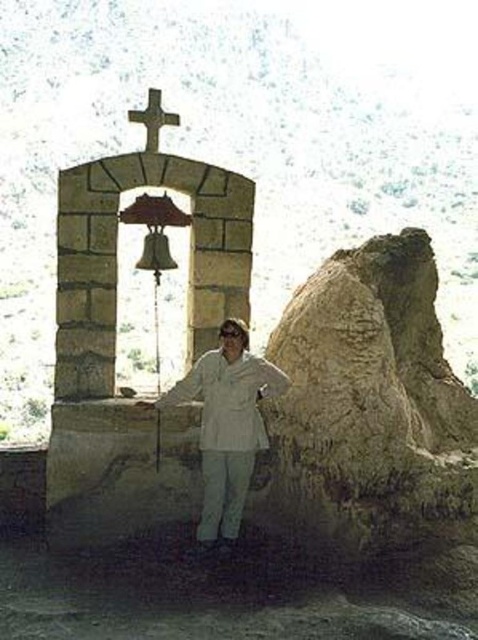
Between white matte jacket at center and metallic cross at upper center, which one is positioned lower?

Positioned lower is white matte jacket at center.

From the picture: Who is positioned more to the right, white matte jacket at center or metallic cross at upper center?

From the viewer's perspective, white matte jacket at center appears more on the right side.

Is point (238, 454) positioned in front of point (148, 106)?

Yes, point (238, 454) is in front of point (148, 106).

The image size is (478, 640). Identify the location of white matte jacket at center. (227, 424).